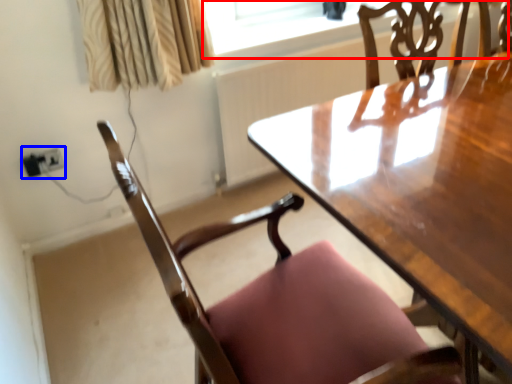
Question: Which object appears farthest to the camera in this image, window screen (highlighted by a red box) or electric outlet (highlighted by a blue box)?

Choices:
 (A) window screen
 (B) electric outlet

Answer: (A)